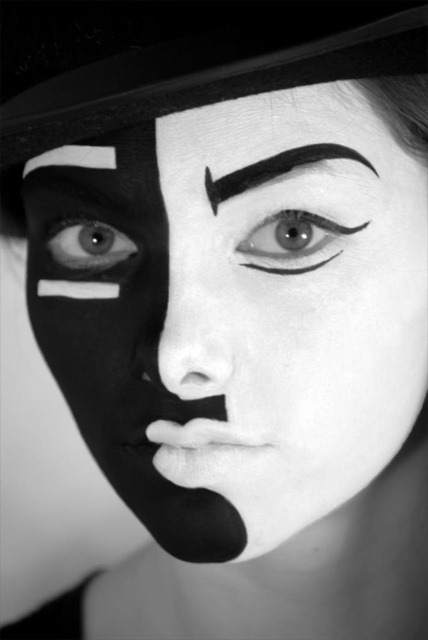
How much distance is there between smooth matte eye at center and black smooth eyebrow at upper center?

smooth matte eye at center is 1.00 inches away from black smooth eyebrow at upper center.

Can you confirm if smooth matte eye at center is wider than black smooth eyebrow at upper center?

Incorrect, smooth matte eye at center's width does not surpass black smooth eyebrow at upper center's.

The image size is (428, 640). Identify the location of smooth matte eye at center. (291, 241).

In the scene shown: Does black matte face at center appear under smooth matte nose at center?

Yes.

Between black matte face at center and smooth matte nose at center, which one is positioned lower?

Positioned lower is black matte face at center.

The height and width of the screenshot is (640, 428). Find the location of `black matte face at center`. black matte face at center is located at coordinates (237, 310).

Can you confirm if black matte face at center is wider than smooth matte eye at center?

Yes.

How distant is black matte face at center from smooth matte eye at center?

They are 2.66 inches apart.

The height and width of the screenshot is (640, 428). Describe the element at coordinates (237, 310) in the screenshot. I see `black matte face at center` at that location.

At what (x,y) coordinates should I click in order to perform the action: click on black matte face at center. Please return your answer as a coordinate pair (x, y). Image resolution: width=428 pixels, height=640 pixels. Looking at the image, I should click on (237, 310).